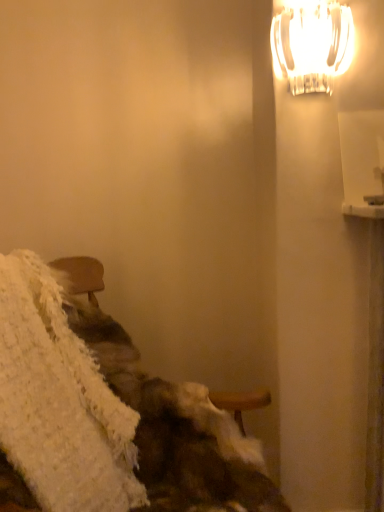
Question: Considering the positions of point (301, 56) and point (142, 487), is point (301, 56) closer or farther from the camera than point (142, 487)?

Choices:
 (A) closer
 (B) farther

Answer: (A)

Question: From a real-world perspective, is white frosted glass lamp at upper right physically located above or below white fluffy blanket at lower left?

Choices:
 (A) below
 (B) above

Answer: (B)

Question: In terms of size, does white frosted glass lamp at upper right appear bigger or smaller than white fluffy blanket at lower left?

Choices:
 (A) small
 (B) big

Answer: (A)

Question: From a real-world perspective, is white fluffy blanket at lower left physically located above or below white frosted glass lamp at upper right?

Choices:
 (A) below
 (B) above

Answer: (A)

Question: From their relative heights in the image, would you say white fluffy blanket at lower left is taller or shorter than white frosted glass lamp at upper right?

Choices:
 (A) tall
 (B) short

Answer: (A)

Question: In the image, is white fluffy blanket at lower left on the left side or the right side of white frosted glass lamp at upper right?

Choices:
 (A) left
 (B) right

Answer: (A)

Question: Considering their positions, is white fluffy blanket at lower left located in front of or behind white frosted glass lamp at upper right?

Choices:
 (A) front
 (B) behind

Answer: (A)